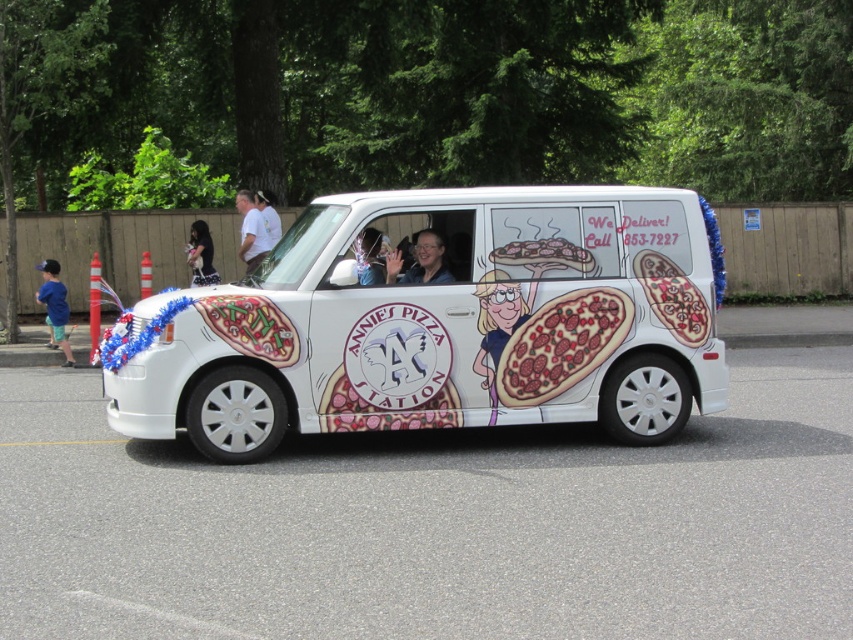
Question: Can you confirm if cartoon character at center is positioned to the left of blue cotton shirt at left?

Choices:
 (A) no
 (B) yes

Answer: (A)

Question: Which object is the farthest from the cartoon character at center?

Choices:
 (A) dark hair at center
 (B) white glossy van at center

Answer: (A)

Question: Which point is farther to the camera?

Choices:
 (A) dark hair at center
 (B) white t-shirt at center
 (C) cartoon character at center
 (D) cartoon pizza at center

Answer: (A)

Question: Which object appears farthest from the camera in this image?

Choices:
 (A) matte black camera at center
 (B) matte black glasses at center

Answer: (B)

Question: Is white t-shirt at center closer to camera compared to matte black camera at center?

Choices:
 (A) yes
 (B) no

Answer: (B)

Question: Can you confirm if white t-shirt at center is bigger than dark hair at center?

Choices:
 (A) yes
 (B) no

Answer: (A)